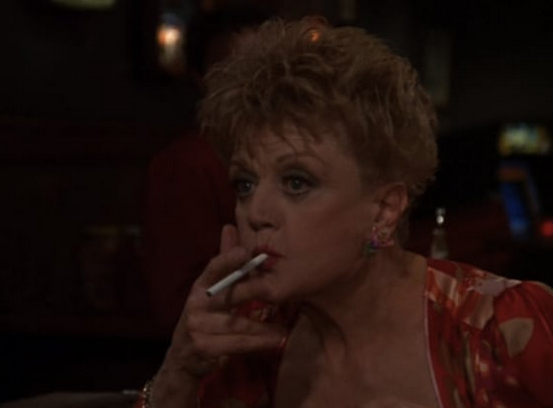
Locate an element on the screen. makeup is located at coordinates (325, 173).